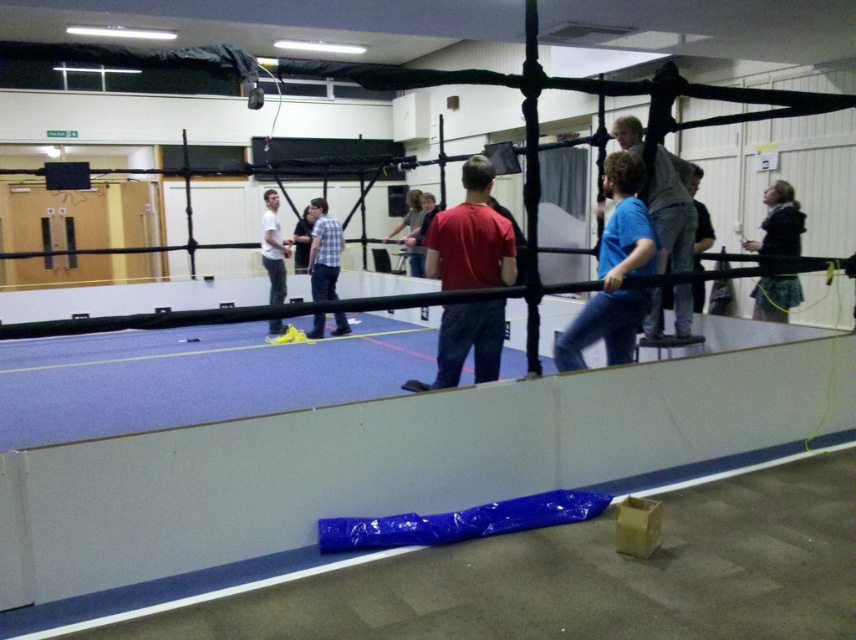
Which of these two, blue matte shirt at center or white matte shirt at center, stands taller?

With more height is white matte shirt at center.

From the picture: Does blue matte shirt at center appear over white matte shirt at center?

No, blue matte shirt at center is not above white matte shirt at center.

Which is behind, point (605, 308) or point (266, 248)?

The point (266, 248) is more distant.

Locate an element on the screen. blue matte shirt at center is located at coordinates (614, 272).

Between point (621, 141) and point (265, 220), which one is positioned behind?

Point (265, 220)

Which is in front, point (675, 310) or point (277, 227)?

Positioned in front is point (675, 310).

Who is more forward, (x=664, y=243) or (x=266, y=266)?

Point (x=664, y=243) is more forward.

Where is `blue matte shirt at upper center`? This screenshot has width=856, height=640. blue matte shirt at upper center is located at coordinates (670, 211).

Between blue matte shirt at upper center and dark blue textured skirt at right, which one has more height?

blue matte shirt at upper center is taller.

Locate an element on the screen. The image size is (856, 640). blue matte shirt at upper center is located at coordinates (670, 211).

This screenshot has width=856, height=640. What do you see at coordinates (670, 211) in the screenshot?
I see `blue matte shirt at upper center` at bounding box center [670, 211].

Where is `blue matte shirt at upper center`? This screenshot has height=640, width=856. blue matte shirt at upper center is located at coordinates (670, 211).